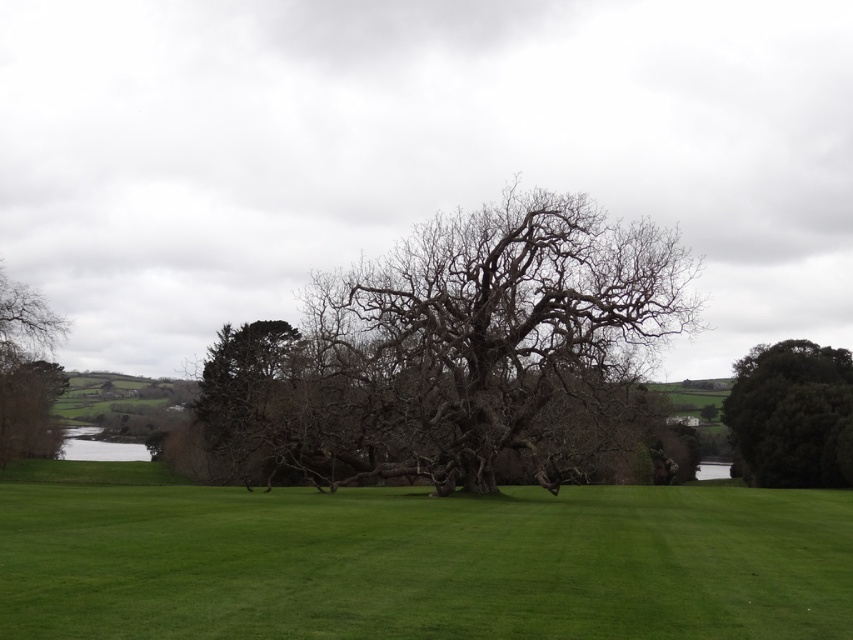
Question: Can you confirm if bare branches at center is thinner than dark green leafy tree at right?

Choices:
 (A) no
 (B) yes

Answer: (A)

Question: Which is farther from the bare branches at center?

Choices:
 (A) bare branches at left
 (B) dark green leafy tree at right

Answer: (B)

Question: Which object is closer to the camera taking this photo?

Choices:
 (A) dark green leafy tree at right
 (B) bare branches at center
 (C) bare branches at left

Answer: (B)

Question: Is bare branches at center below dark green leafy tree at right?

Choices:
 (A) no
 (B) yes

Answer: (A)

Question: Which point is closer to the camera taking this photo?

Choices:
 (A) (454, 426)
 (B) (769, 413)

Answer: (A)

Question: Does dark green leafy tree at right appear on the right side of bare branches at left?

Choices:
 (A) no
 (B) yes

Answer: (B)